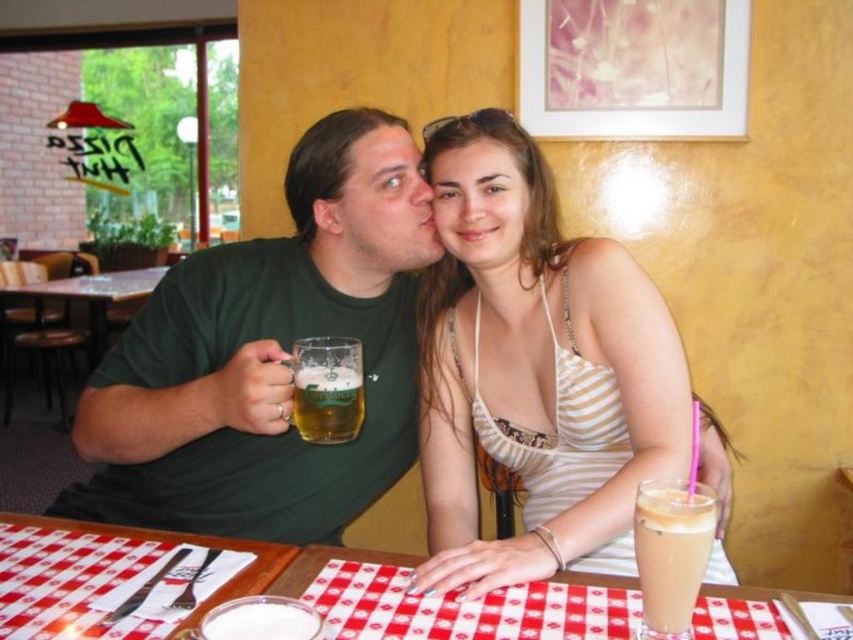
Question: Which of the following is the closest to the observer?

Choices:
 (A) (660, 513)
 (B) (341, 387)
 (C) (86, 276)
 (D) (119, 560)

Answer: (A)

Question: Among these points, which one is nearest to the camera?

Choices:
 (A) (323, 408)
 (B) (538, 554)

Answer: (A)

Question: Does white striped tank top at center appear on the right side of red checkered tablecloth at center?

Choices:
 (A) no
 (B) yes

Answer: (B)

Question: Is red checkered tablecloth at center above green glass beer at center?

Choices:
 (A) no
 (B) yes

Answer: (A)

Question: Does red checkered tablecloth at center have a lesser width compared to iced coffee at lower right?

Choices:
 (A) no
 (B) yes

Answer: (A)

Question: Estimate the real-world distances between objects in this image. Which object is closer to the wooden table at center?

Choices:
 (A) green glass beer at center
 (B) red checkered tablecloth at lower left
 (C) green matte shirt at left
 (D) iced coffee at lower right

Answer: (C)